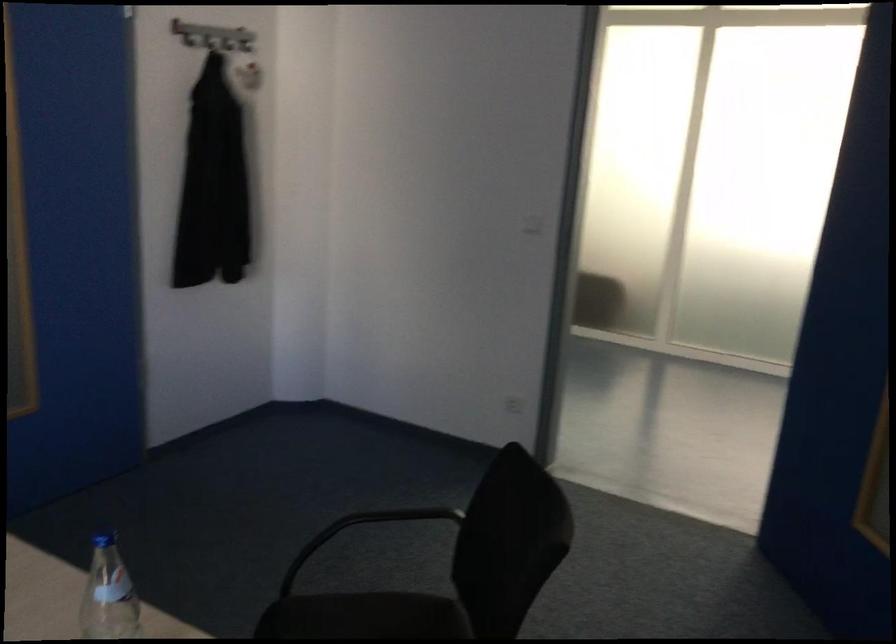
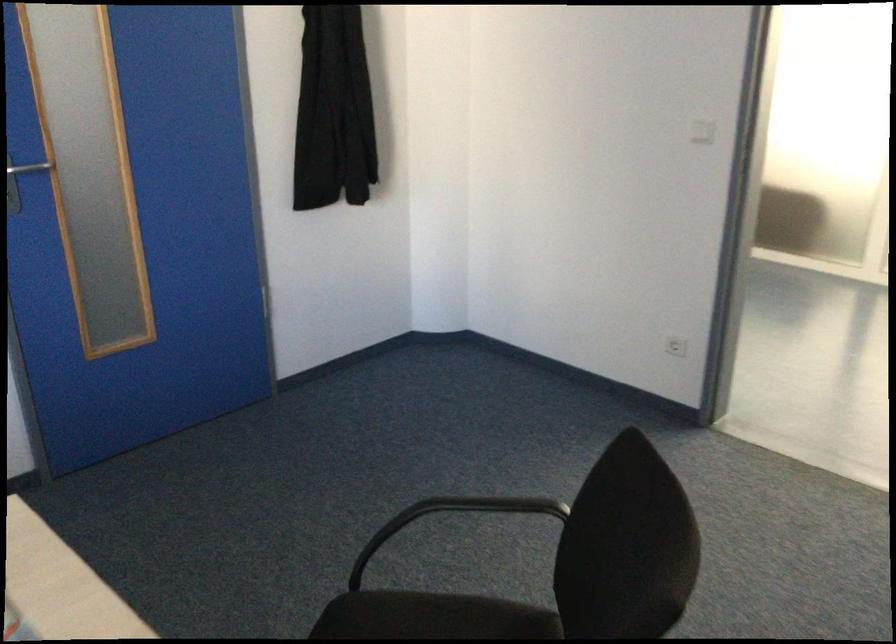
Question: What movement of the cameraman would produce the second image?

Choices:
 (A) Left
 (B) Right
 (C) Forward
 (D) Backward

Answer: (C)